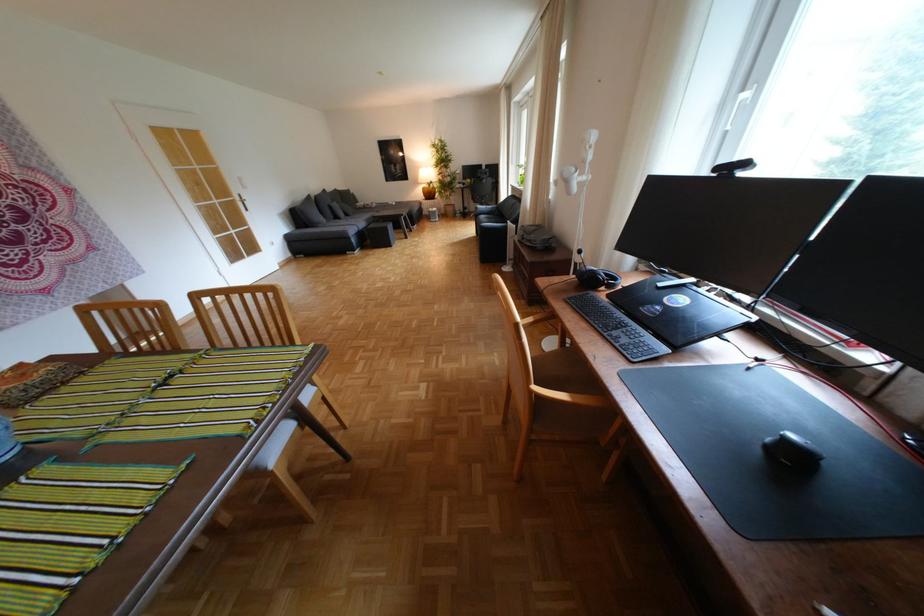
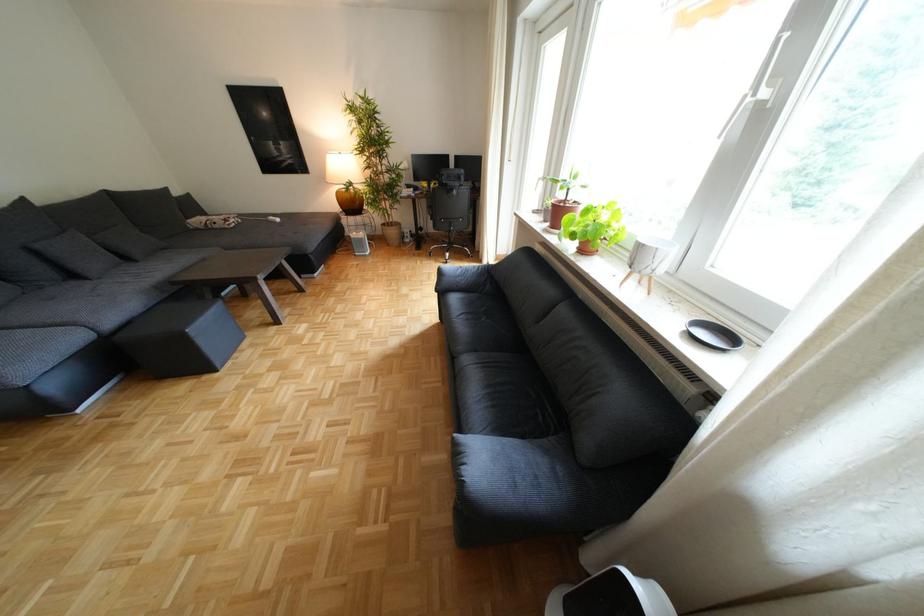
The point at (343, 208) is marked in the first image. Where is the corresponding point in the second image?

(49, 253)